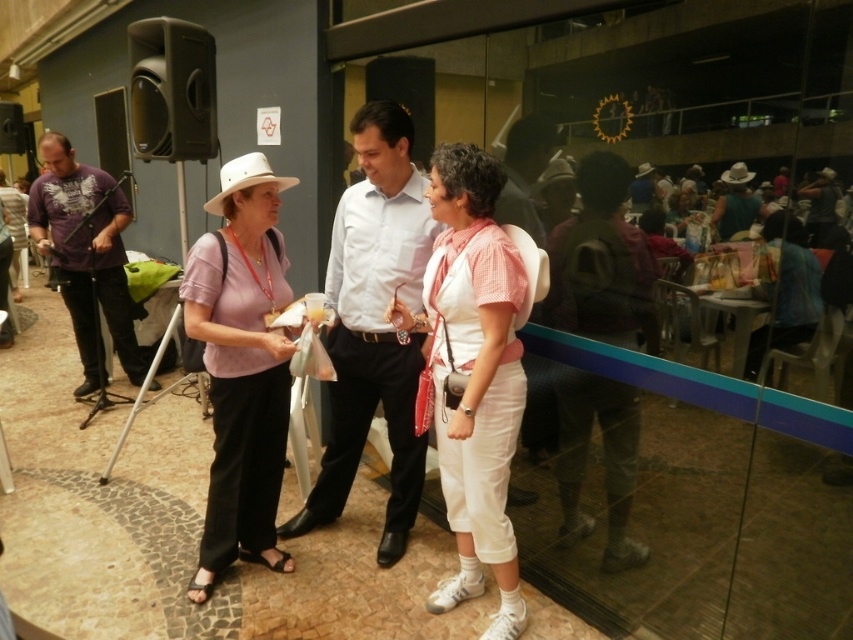
Question: Does matte pink shirt at center appear over purple cotton shirt at left?

Choices:
 (A) yes
 (B) no

Answer: (B)

Question: Which point is closer to the camera taking this photo?

Choices:
 (A) (474, 582)
 (B) (65, 300)

Answer: (A)

Question: Is light blue shirt at center to the left of purple cotton shirt at left from the viewer's perspective?

Choices:
 (A) yes
 (B) no

Answer: (B)

Question: Based on their relative distances, which object is farther from the matte white cowboy hat at upper right?

Choices:
 (A) purple cotton shirt at left
 (B) white cotton shirt at center

Answer: (A)

Question: Among these objects, which one is nearest to the camera?

Choices:
 (A) matte white cowboy hat at upper right
 (B) white cotton shirt at center
 (C) purple cotton shirt at left
 (D) matte pink shirt at center

Answer: (A)

Question: Is white cotton shirt at center below light blue shirt at center?

Choices:
 (A) yes
 (B) no

Answer: (A)